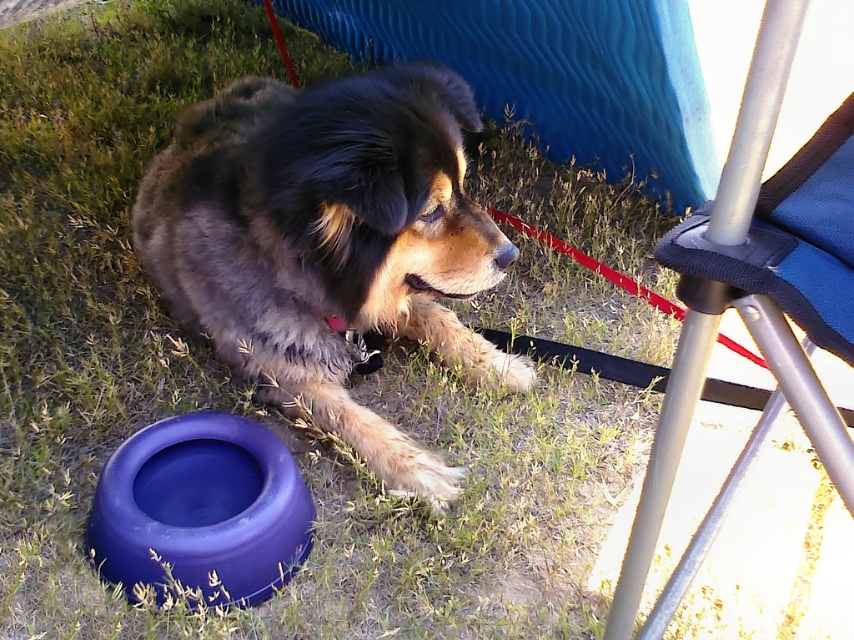
Question: Is fuzzy brown dog at center positioned at the back of metallic silver folding chair at right?

Choices:
 (A) no
 (B) yes

Answer: (B)

Question: Which object is farther from the camera taking this photo?

Choices:
 (A) metallic silver folding chair at right
 (B) fuzzy brown dog at center

Answer: (B)

Question: Is fuzzy brown dog at center further to camera compared to metallic silver folding chair at right?

Choices:
 (A) yes
 (B) no

Answer: (A)

Question: Is fuzzy brown dog at center to the left of metallic silver folding chair at right from the viewer's perspective?

Choices:
 (A) yes
 (B) no

Answer: (A)

Question: Which point appears farthest from the camera in this image?

Choices:
 (A) (410, 164)
 (B) (787, 172)

Answer: (A)